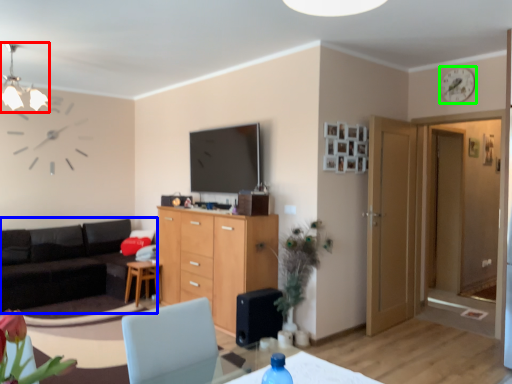
Question: Which object is positioned closest to light fixture (highlighted by a red box)? Select from studio couch (highlighted by a blue box) and clock (highlighted by a green box).

Choices:
 (A) studio couch
 (B) clock

Answer: (A)